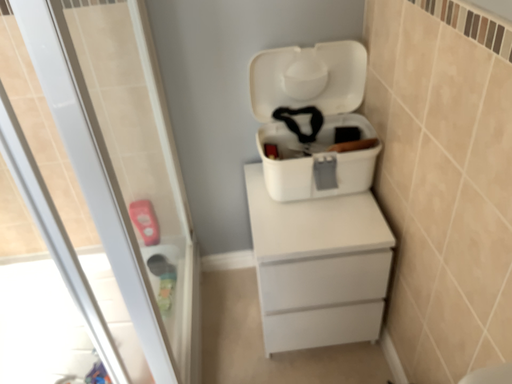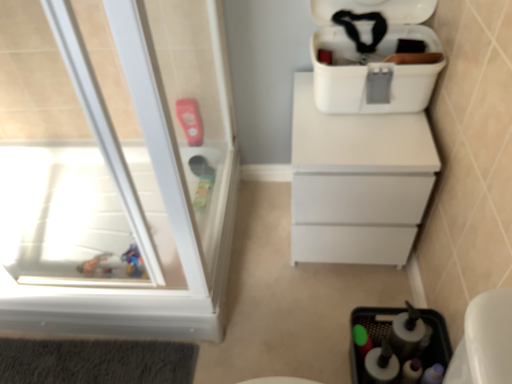
Question: How did the camera likely rotate when shooting the video?

Choices:
 (A) rotated right
 (B) rotated left

Answer: (B)